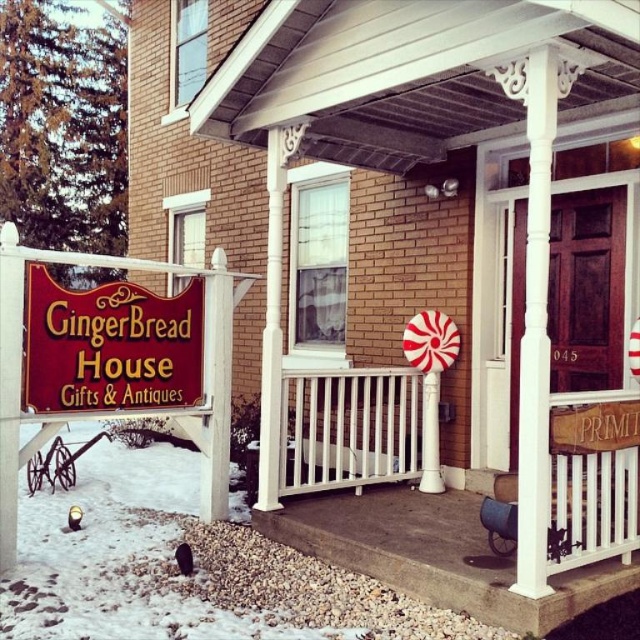
Can you confirm if wooden signboard at lower left is smaller than white carved wood pillar at center?

Incorrect, wooden signboard at lower left is not smaller in size than white carved wood pillar at center.

Does wooden signboard at lower left come in front of white carved wood pillar at center?

No, it is behind white carved wood pillar at center.

Between point (180, 296) and point (529, 416), which one is positioned behind?

The point (180, 296) is more distant.

This screenshot has width=640, height=640. I want to click on wooden signboard at lower left, so click(x=109, y=346).